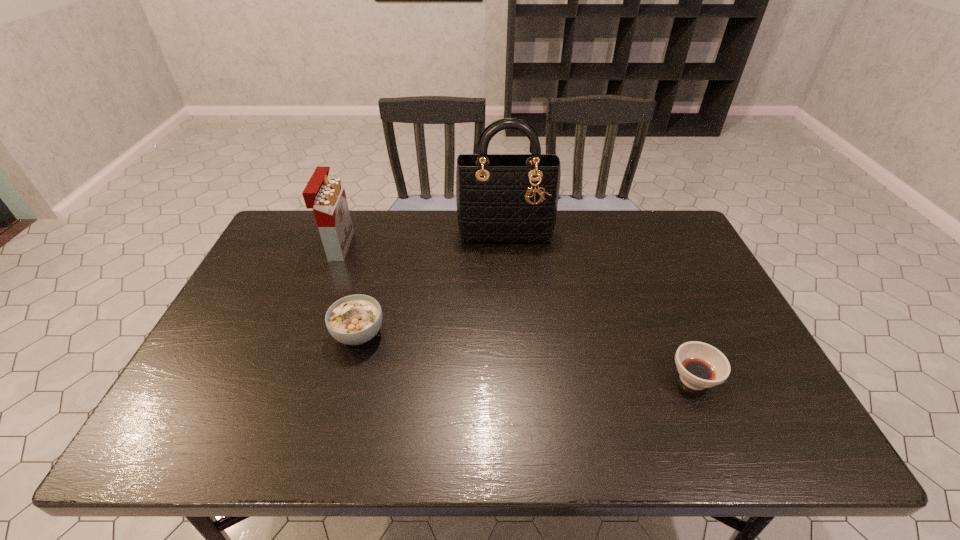
Locate an element on the screen. This screenshot has height=540, width=960. vacant space situated on the back of the farther soup bowl is located at coordinates (368, 299).

This screenshot has width=960, height=540. I want to click on vacant space located on the back of the right soup bowl, so click(668, 320).

The image size is (960, 540). In order to click on handbag that is at the far edge in this screenshot , I will do `click(504, 198)`.

The image size is (960, 540). In order to click on cigarette case that is positioned at the far edge in this screenshot , I will do point(326,196).

This screenshot has width=960, height=540. I want to click on object that is at the right edge, so click(x=700, y=365).

In the image, there is a desktop. Where is `vacant space at the far edge`? This screenshot has width=960, height=540. vacant space at the far edge is located at coordinates (369, 232).

Find the location of a particular element. This screenshot has height=540, width=960. vacant area at the near edge is located at coordinates (470, 445).

This screenshot has height=540, width=960. In order to click on free space at the left edge of the desktop in this screenshot , I will do `click(285, 282)`.

The image size is (960, 540). Identify the location of vacant space at the right edge of the desktop. (744, 372).

The image size is (960, 540). In the image, there is a desktop. Find the location of `free space at the far left corner`. free space at the far left corner is located at coordinates (283, 221).